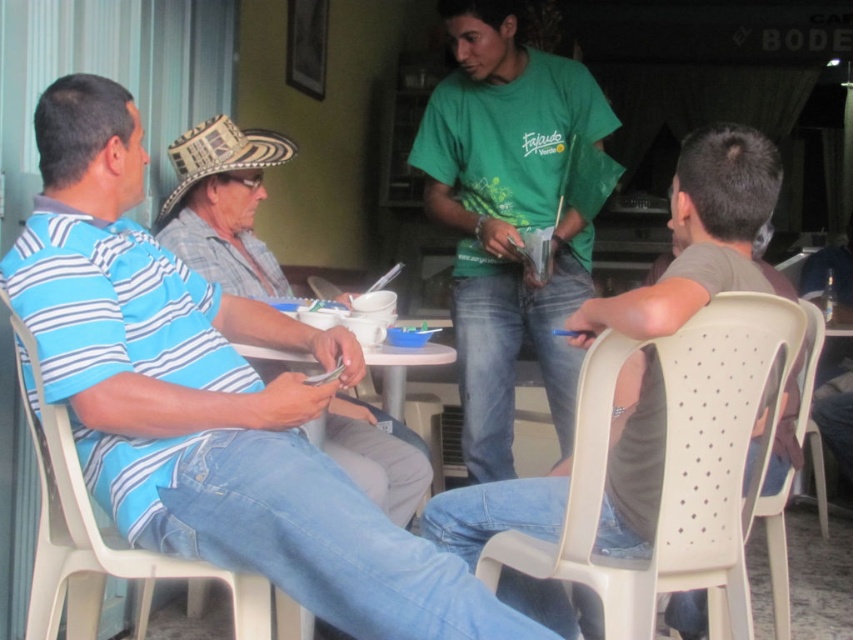
Question: Which of these objects is positioned closest to the white plastic chair at right?

Choices:
 (A) plaid fabric shirt at center
 (B) woven straw cowboy hat at upper left
 (C) blue striped shirt at left

Answer: (C)

Question: Is blue striped shirt at left smaller than plaid fabric shirt at center?

Choices:
 (A) no
 (B) yes

Answer: (B)

Question: Is white plastic chair at right further to the viewer compared to white plastic table at center?

Choices:
 (A) yes
 (B) no

Answer: (B)

Question: Which object appears farthest from the camera in this image?

Choices:
 (A) white plastic table at center
 (B) white plastic chair at right
 (C) white plastic chair at left
 (D) blue striped shirt at left

Answer: (A)

Question: Considering the relative positions of white plastic chair at right and white plastic table at center in the image provided, where is white plastic chair at right located with respect to white plastic table at center?

Choices:
 (A) above
 (B) below

Answer: (A)

Question: Which point appears closest to the camera in this image?

Choices:
 (A) (160, 544)
 (B) (485, 67)
 (C) (171, 198)
 (D) (77, 474)

Answer: (A)